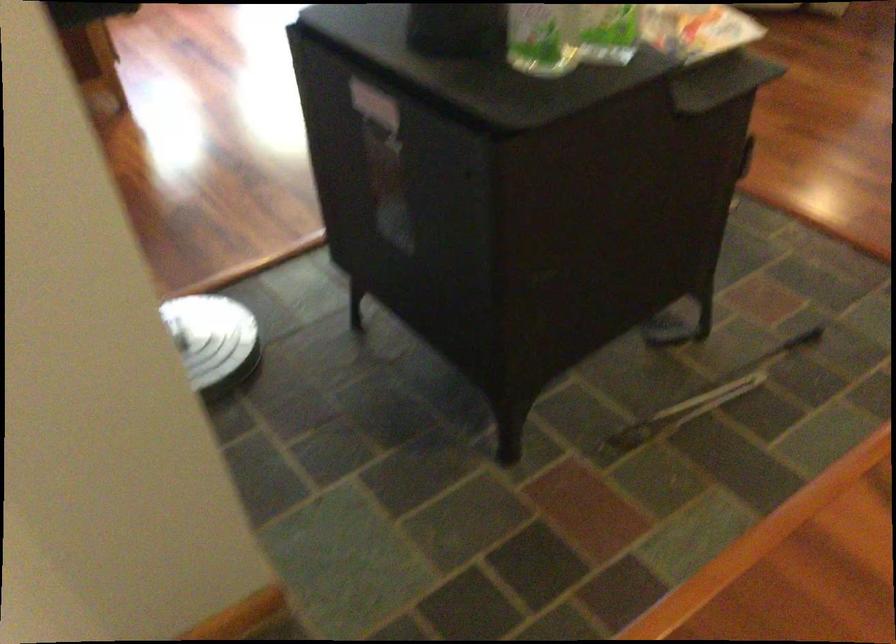
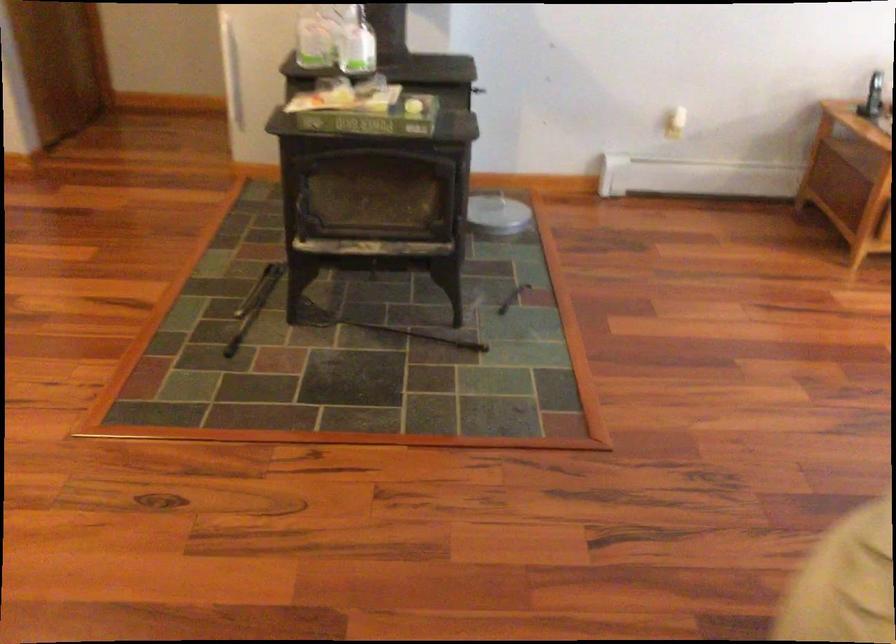
Question: I am providing you with two images of the same scene from different viewpoints. Please identify which objects are invisible in image2.

Choices:
 (A) black flashlight
 (B) stove door handle
 (C) black fireplace tool
 (D) black metal tool

Answer: (B)